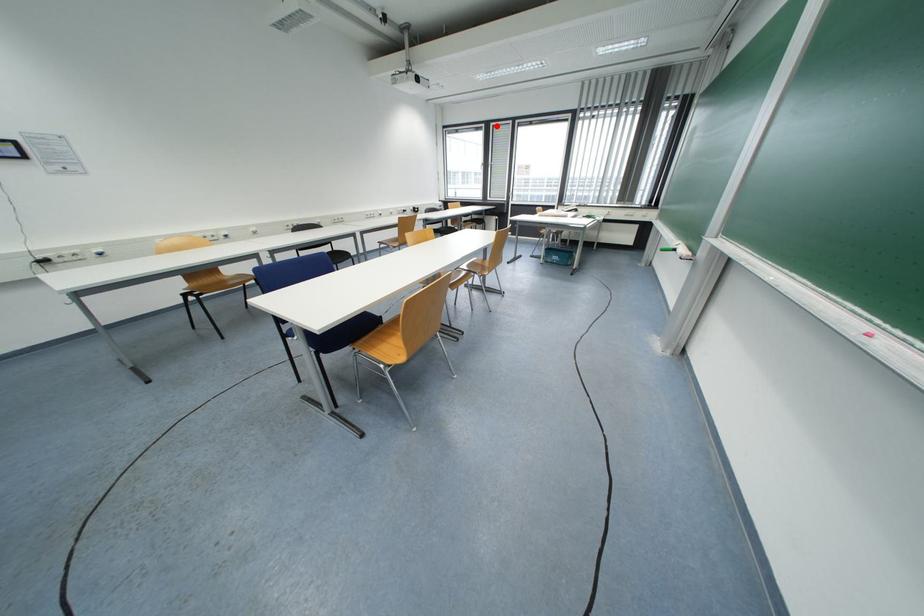
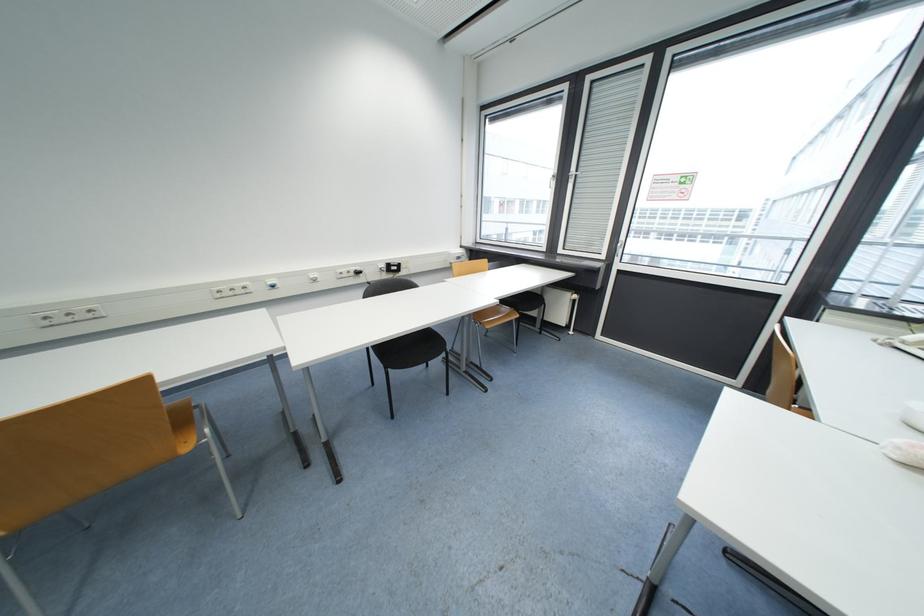
Question: I am providing you with two images of the same scene from different viewpoints. A red point is shown in image1. For the corresponding object point in image2, is it positioned nearer or farther from the camera?

Choices:
 (A) Nearer
 (B) Farther

Answer: (B)